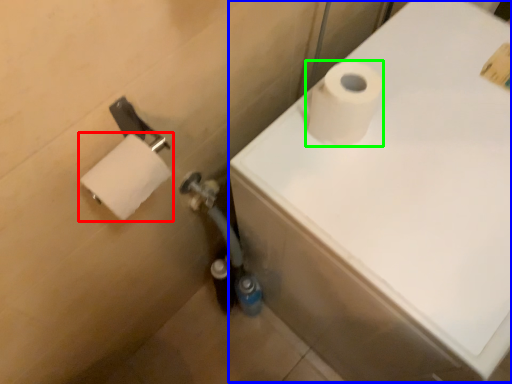
Question: Based on their relative distances, which object is nearer to toilet paper (highlighted by a red box)? Choose from bath (highlighted by a blue box) and toilet paper (highlighted by a green box).

Choices:
 (A) bath
 (B) toilet paper

Answer: (B)